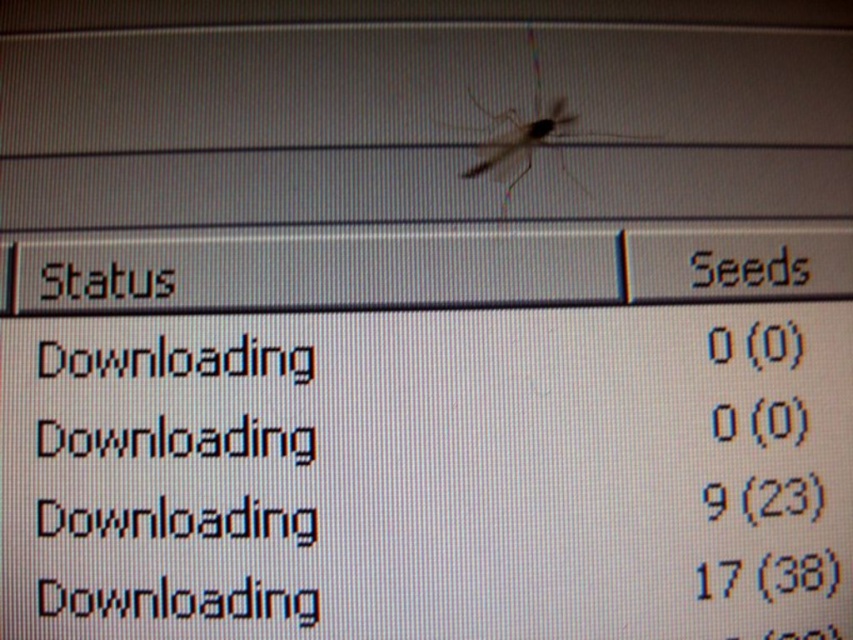
Question: Can you confirm if translucent glass mosquito at center is positioned above black pixelated number at center?

Choices:
 (A) no
 (B) yes

Answer: (B)

Question: Is black digital number at center above black pixelated number at center?

Choices:
 (A) no
 (B) yes

Answer: (B)

Question: Is translucent glass mosquito at center wider than black digital number at center?

Choices:
 (A) yes
 (B) no

Answer: (A)

Question: Which is farther from the black digital number at center?

Choices:
 (A) translucent glass mosquito at center
 (B) black pixelated number at center

Answer: (A)

Question: Among these points, which one is nearest to the camera?

Choices:
 (A) (479, 109)
 (B) (718, 419)
 (C) (706, 499)

Answer: (C)

Question: Which object is farther from the camera taking this photo?

Choices:
 (A) black digital number at center
 (B) black pixelated number at center
 (C) translucent glass mosquito at center

Answer: (C)